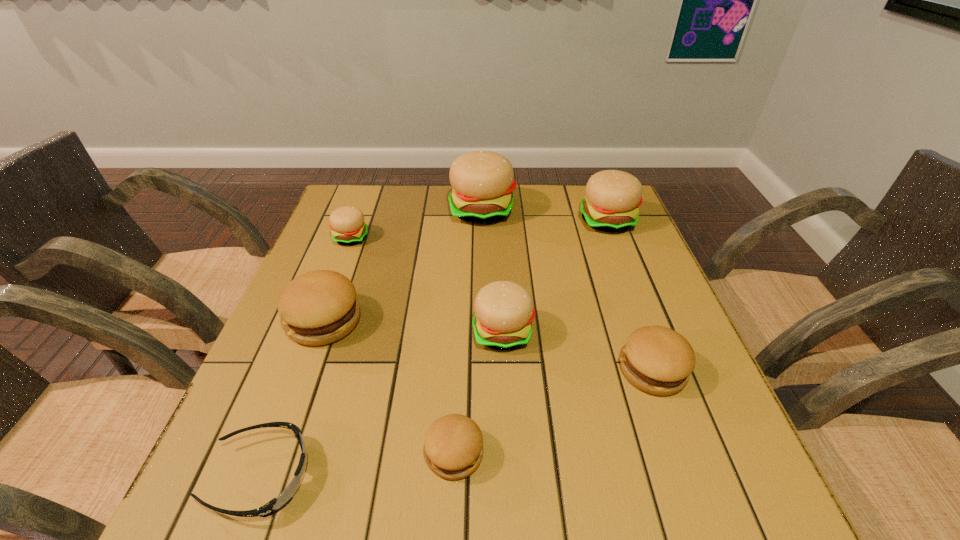
Where is `vacant space that's between the nearest beige hamburger and the rightmost brown hamburger`? vacant space that's between the nearest beige hamburger and the rightmost brown hamburger is located at coordinates (578, 352).

Where is `free space between the second shortest object and the leftmost beige hamburger`? This screenshot has height=540, width=960. free space between the second shortest object and the leftmost beige hamburger is located at coordinates point(403,346).

Locate an element on the screen. The image size is (960, 540). vacant area that lies between the nearest hamburger and the nearest beige hamburger is located at coordinates (479, 393).

The image size is (960, 540). What are the coordinates of `free spot between the biggest beige hamburger and the rightmost brown hamburger` in the screenshot? It's located at (567, 291).

What are the coordinates of `vacant area between the sunglasses and the leftmost beige hamburger` in the screenshot? It's located at (306, 357).

You are a GUI agent. You are given a task and a screenshot of the screen. Output one action in this format:
    pyautogui.click(x=<x>, y=<y>)
    Task: Click on the vacant space in between the nearest beige hamburger and the biggest brown hamburger
    
    Given the screenshot: What is the action you would take?
    pyautogui.click(x=414, y=327)

At what (x,y) coordinates should I click in order to perform the action: click on vacant space that's between the leftmost brown hamburger and the seventh tallest object. Please return your answer as a coordinate pair (x, y). This screenshot has height=540, width=960. Looking at the image, I should click on (390, 387).

Where is `free space between the shortest object and the leftmost brown hamburger`? free space between the shortest object and the leftmost brown hamburger is located at coordinates (293, 399).

This screenshot has height=540, width=960. I want to click on the seventh closest object to the second tallest hamburger, so click(276, 504).

Where is `object that stands as the fourth closest to the sunglasses`? This screenshot has width=960, height=540. object that stands as the fourth closest to the sunglasses is located at coordinates (347, 225).